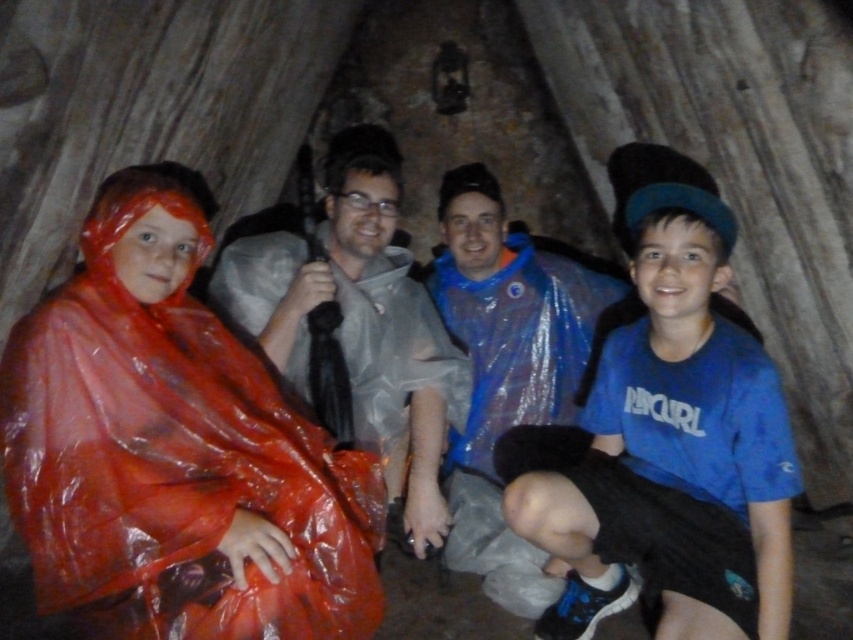
Question: Can you confirm if blue cotton shirt at center is wider than matte gray raincoat at center?

Choices:
 (A) no
 (B) yes

Answer: (A)

Question: From the image, what is the correct spatial relationship of blue cotton shirt at center in relation to matte gray raincoat at center?

Choices:
 (A) above
 (B) below

Answer: (A)

Question: Considering the relative positions of blue cotton shirt at center and matte gray raincoat at center in the image provided, where is blue cotton shirt at center located with respect to matte gray raincoat at center?

Choices:
 (A) right
 (B) left

Answer: (A)

Question: Among these objects, which one is nearest to the camera?

Choices:
 (A) matte gray raincoat at center
 (B) blue cotton shirt at center

Answer: (B)

Question: Among these objects, which one is nearest to the camera?

Choices:
 (A) blue cotton shirt at center
 (B) matte gray raincoat at center

Answer: (A)

Question: Which of the following is the farthest from the observer?

Choices:
 (A) (305, 269)
 (B) (544, 522)

Answer: (A)